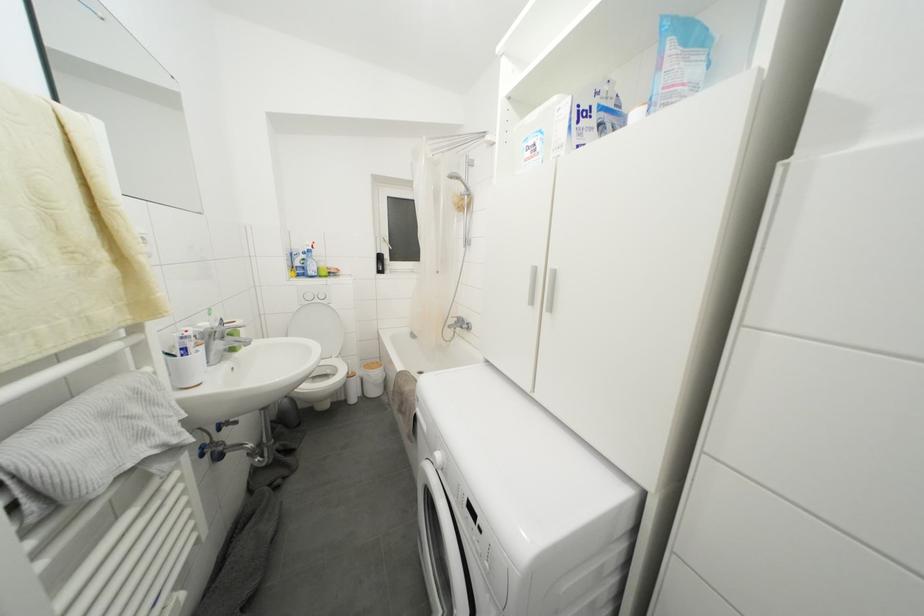
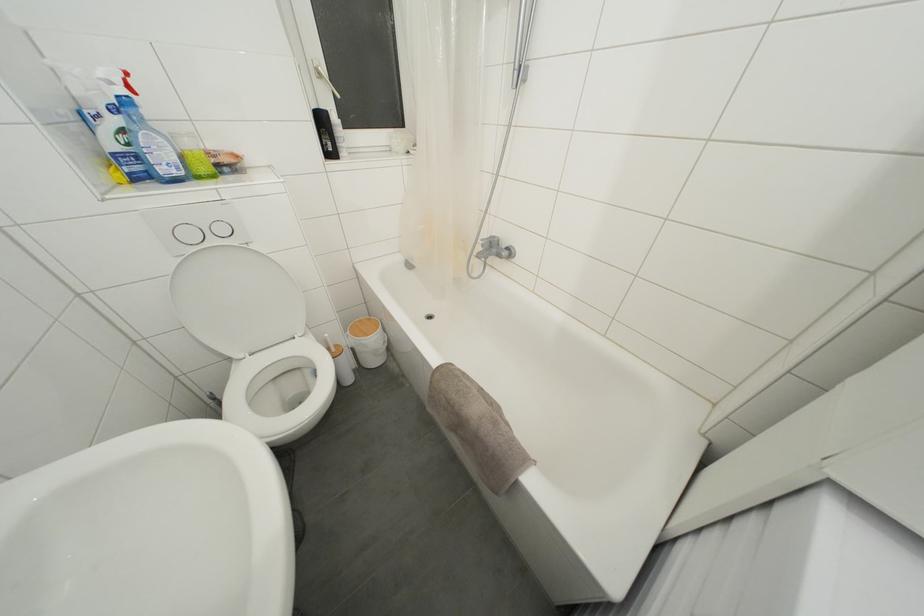
Question: I am providing you with two images of the same scene from different viewpoints. Please identify which objects are invisible in image2.

Choices:
 (A) toilet flush button
 (B) wooden trash can lid
 (C) silver faucet handle
 (D) none of these

Answer: (D)